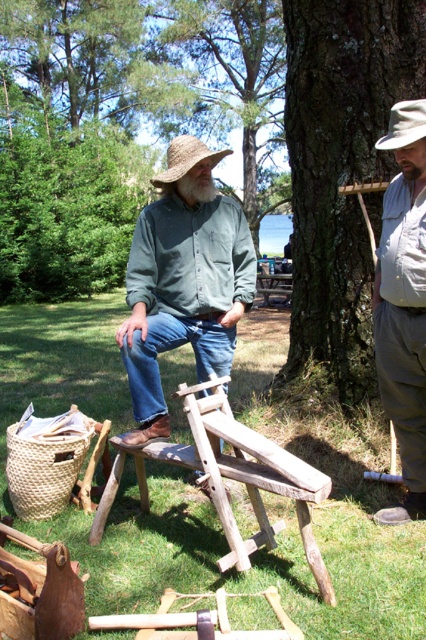
You are a photographer positioned in the scene and want to capture both the straw hat at upper center and the white soft beard at center in your photo. Since you want to focus on the closer object, which one should you adjust your camera to focus on?

The straw hat at upper center is closer to the viewer than the white soft beard at center, so you should focus your camera on the straw hat at upper center.

You are a hiker who just arrived at this outdoor area. You notice the green matte shirt at center and the green bark tree at upper center. Which object is closer to you?

The green matte shirt at center is closer to you because it is in front of the green bark tree at upper center.

You are standing at the origin point of the image coordinate system. Where is the green matte shirt at center located?

The green matte shirt at center is located at point (183, 284).